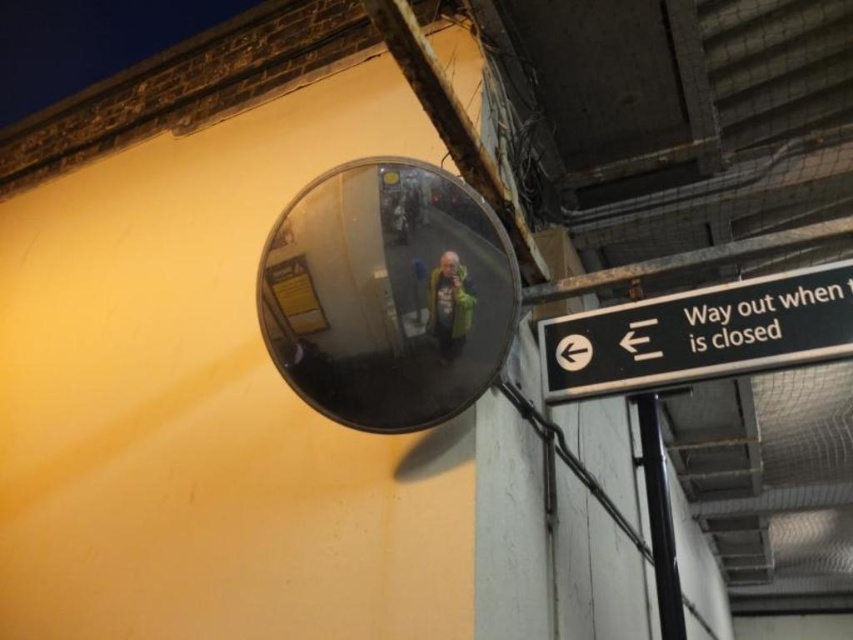
This screenshot has height=640, width=853. What do you see at coordinates (387, 294) in the screenshot?
I see `transparent glass mirror at upper center` at bounding box center [387, 294].

Which is in front, point (399, 337) or point (675, 356)?

Point (399, 337) is in front.

Who is more distant from viewer, (363, 282) or (798, 356)?

The point (798, 356) is behind.

Locate an element on the screen. Image resolution: width=853 pixels, height=640 pixels. transparent glass mirror at upper center is located at coordinates (387, 294).

Which is behind, point (581, 371) or point (659, 602)?

The point (659, 602) is more distant.

You are a GUI agent. You are given a task and a screenshot of the screen. Output one action in this format:
    pyautogui.click(x=<x>, y=<y>)
    Task: Click on the black plastic sign at upper right
    
    Given the screenshot: What is the action you would take?
    pyautogui.click(x=700, y=333)

How much distance is there between transparent glass mirror at upper center and black metal pole at lower right?

They are 1.29 meters apart.

Consider the image. Does transparent glass mirror at upper center have a smaller size compared to black metal pole at lower right?

Yes.

What are the coordinates of `transparent glass mirror at upper center` in the screenshot? It's located at click(387, 294).

The width and height of the screenshot is (853, 640). In order to click on transparent glass mirror at upper center in this screenshot , I will do `click(387, 294)`.